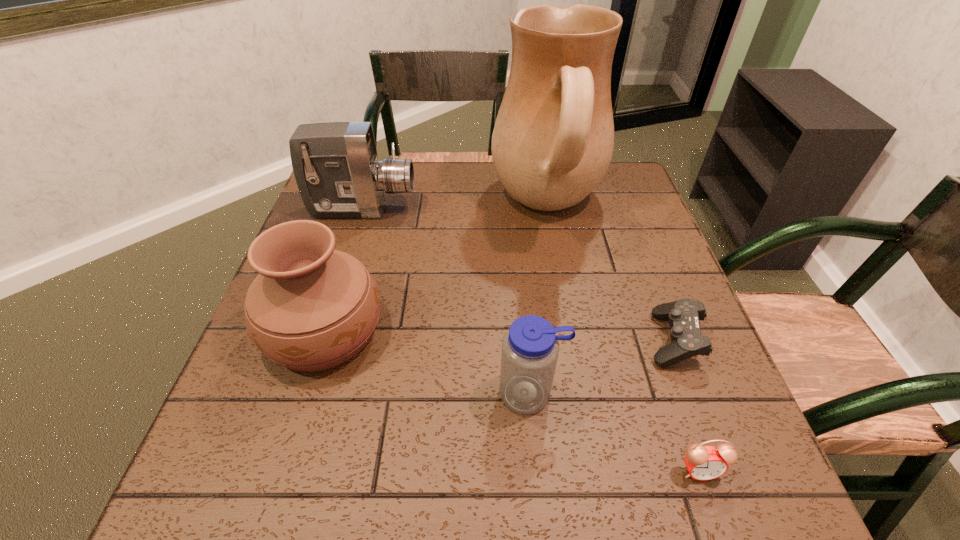
At what (x,y) coordinates should I click in order to perform the action: click on vacant area between the urn and the control. Please return your answer as a coordinate pair (x, y). Looking at the image, I should click on (499, 334).

At what (x,y) coordinates should I click in order to perform the action: click on free space between the tallest object and the water bottle. Please return your answer as a coordinate pair (x, y). The image size is (960, 540). Looking at the image, I should click on (540, 300).

This screenshot has width=960, height=540. Identify the location of vacant space that's between the cream pitcher and the nearest object. (623, 339).

The image size is (960, 540). Identify the location of blank region between the urn and the third shortest object. tap(427, 361).

You are a GUI agent. You are given a task and a screenshot of the screen. Output one action in this format:
    pyautogui.click(x=<x>, y=<y>)
    Task: Click on the vacant area between the tallest object and the third shortest object
    The width and height of the screenshot is (960, 540).
    Given the screenshot: What is the action you would take?
    pyautogui.click(x=540, y=300)

Find the location of a particular element. Image resolution: width=960 pixels, height=540 pixels. free spot between the second shortest object and the water bottle is located at coordinates (614, 431).

This screenshot has height=540, width=960. I want to click on empty space between the fifth tallest object and the cream pitcher, so click(623, 339).

The width and height of the screenshot is (960, 540). Identify the location of blank region between the camcorder and the water bottle. point(447,301).

The height and width of the screenshot is (540, 960). Find the location of `vacant space in between the water bottle and the urn`. vacant space in between the water bottle and the urn is located at coordinates (427, 361).

Locate an element on the screen. Image resolution: width=960 pixels, height=540 pixels. vacant region between the alarm clock and the shortest object is located at coordinates (686, 404).